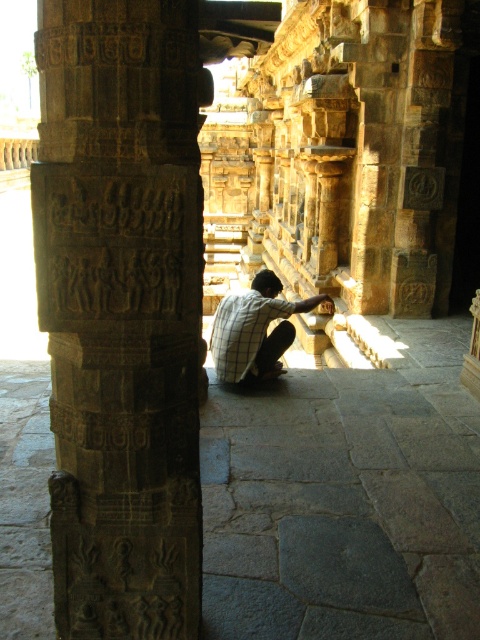
You are standing in the ancient stone structure and want to take a photo of the dark brown stone pillar at left and the checkered fabric man at center. Where should you position yourself to ensure both are in the frame?

Since the dark brown stone pillar at left is below the checkered fabric man at center, you should position yourself so that your camera is angled upwards to capture both the pillar and the man in the frame.

You are standing in the ancient stone structure and want to move from the point at coordinates point (139, 259) to the point at coordinates point (279, 312). Is the destination point closer to you or further away?

Point (139, 259) is in front of point (279, 312), so the destination point at (279, 312) is further away from you.